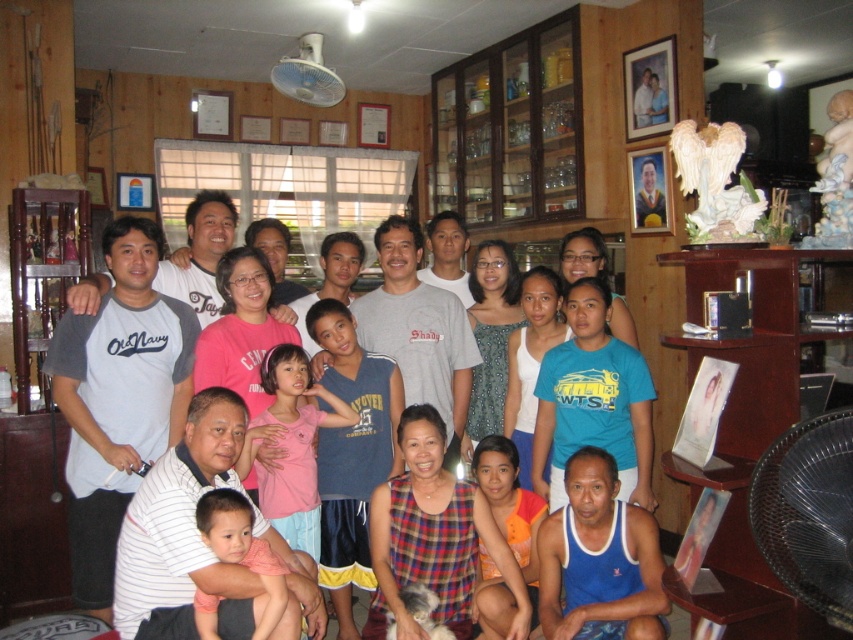
Is pink cotton shirt at center positioned in front of orange printed shirt at lower center?

No, it is behind orange printed shirt at lower center.

The image size is (853, 640). Identify the location of pink cotton shirt at center. click(294, 445).

Between point (289, 499) and point (515, 516), which one is positioned behind?

Point (515, 516)

Image resolution: width=853 pixels, height=640 pixels. I want to click on pink cotton shirt at center, so click(x=294, y=445).

Does striped cotton shirt at center appear on the right side of white striped shirt at lower left?

In fact, striped cotton shirt at center is to the left of white striped shirt at lower left.

Is point (202, 225) less distant than point (186, 630)?

That is False.

Which is in front, point (437, 236) or point (312, 609)?

Point (312, 609) is more forward.

Identify the location of striped cotton shirt at center. (221, 307).

Can you confirm if pink cotton shirt at center is smaller than matte pink shirt at center?

No.

Between point (283, 401) and point (263, 554), which one is positioned in front?

Point (263, 554)

Find the location of `pink cotton shirt at center`. pink cotton shirt at center is located at coordinates (294, 445).